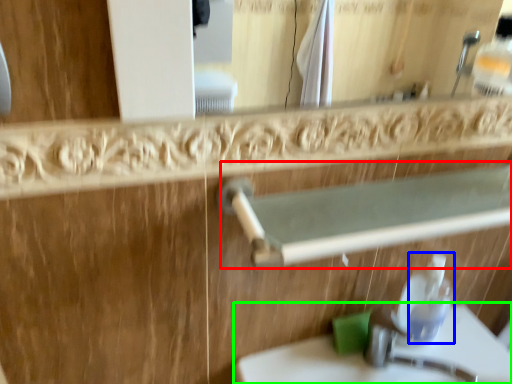
Question: Estimate the real-world distances between objects in this image. Which object is farther from balustrade (highlighted by a red box), soap dispenser (highlighted by a blue box) or sink (highlighted by a green box)?

Choices:
 (A) soap dispenser
 (B) sink

Answer: (B)